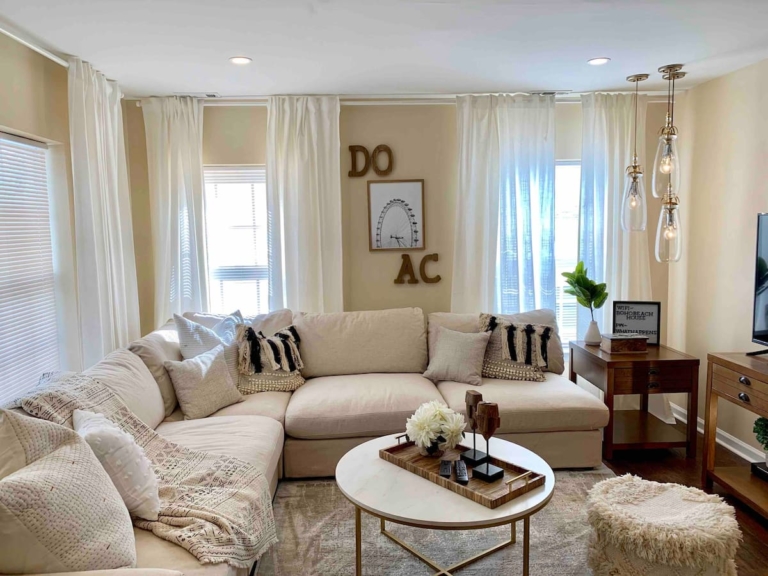
Image resolution: width=768 pixels, height=576 pixels. I want to click on window, so click(x=35, y=302), click(x=245, y=250), click(x=561, y=214).